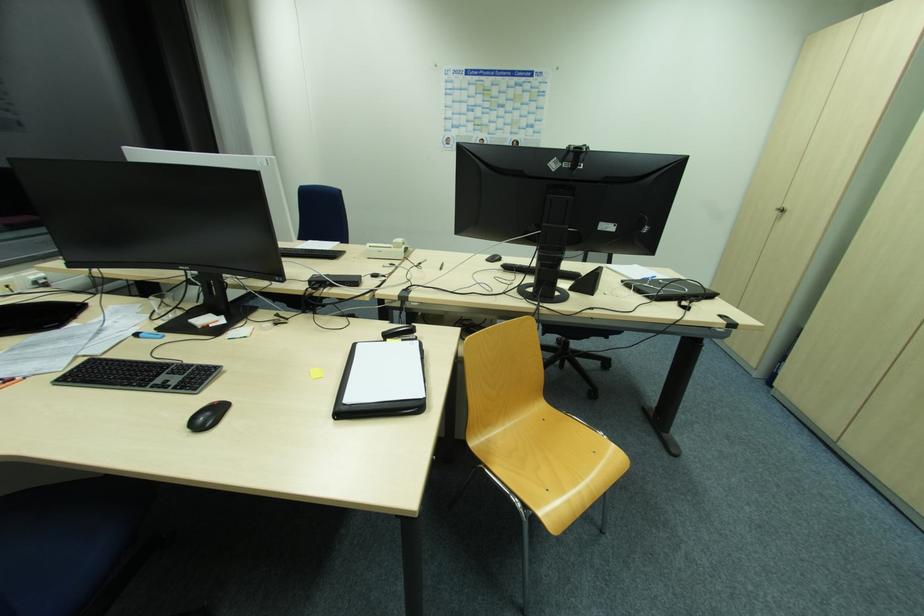
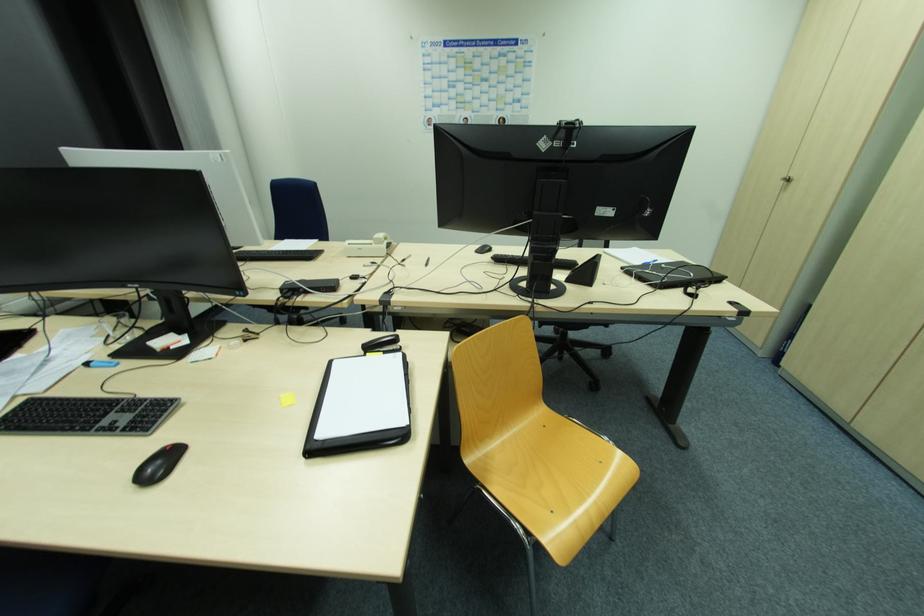
Where in the second image is the point corresponding to (482,464) from the first image?

(480, 483)